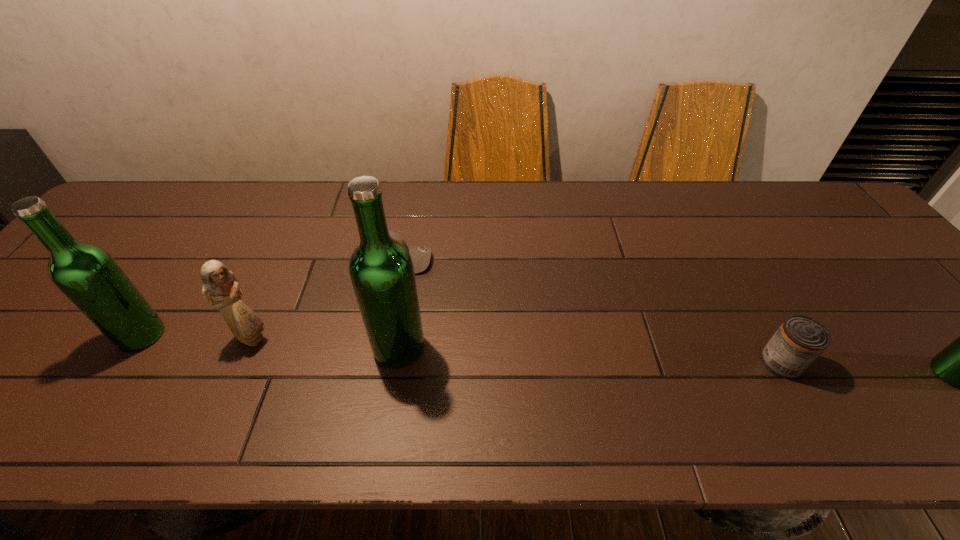
You are a GUI agent. You are given a task and a screenshot of the screen. Output one action in this format:
    pyautogui.click(x=<x>, y=<y>)
    Task: Click on the vacant area located 0.110m on the front-facing side of the fifth object from right to left
    Image resolution: width=960 pixels, height=540 pixels.
    Given the screenshot: What is the action you would take?
    pyautogui.click(x=319, y=338)

Locate an element on the screen. The image size is (960, 540). free space located on the front brim of the shortest object is located at coordinates (573, 260).

Identify the location of free space located on the right of the can. (948, 362).

Image resolution: width=960 pixels, height=540 pixels. I want to click on beer bottle present at the near edge, so click(x=381, y=270).

This screenshot has height=540, width=960. Find the location of `can at the near edge`. can at the near edge is located at coordinates (800, 340).

Locate an element on the screen. This screenshot has width=960, height=540. free spot at the far edge of the desktop is located at coordinates (420, 196).

What are the coordinates of `free space at the near edge` in the screenshot? It's located at (255, 374).

This screenshot has height=540, width=960. In order to click on blank area at the left edge in this screenshot , I will do `click(110, 240)`.

Find the location of `vacant area at the far left corner of the desktop`. vacant area at the far left corner of the desktop is located at coordinates (174, 206).

Locate an element on the screen. free spot at the near left corner of the desktop is located at coordinates (6, 374).